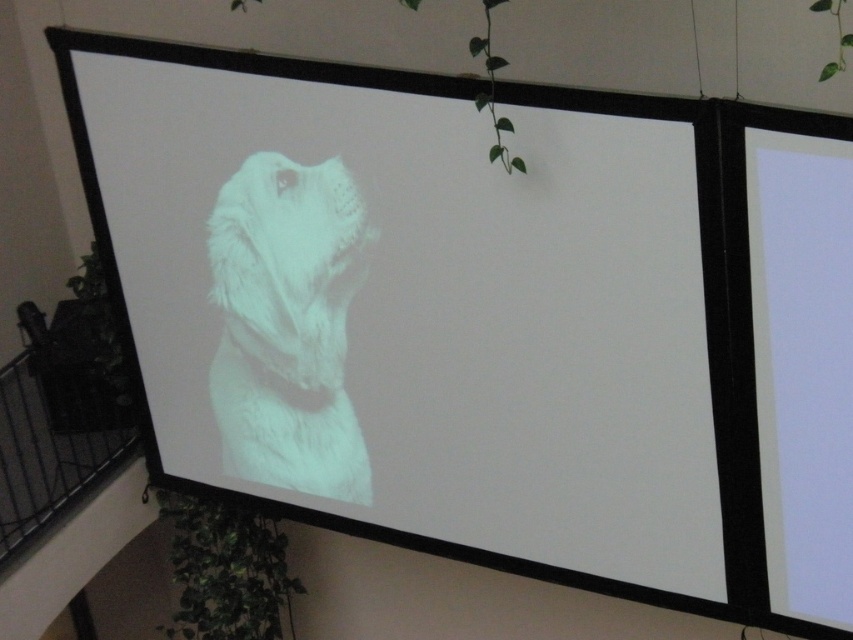
Question: Which of the following is the closest to the observer?

Choices:
 (A) (329, 406)
 (B) (294, 410)

Answer: (A)

Question: Among these objects, which one is farthest from the camera?

Choices:
 (A) white matte dog at center
 (B) white fur dog at center

Answer: (B)

Question: Is white matte dog at center smaller than white fur dog at center?

Choices:
 (A) yes
 (B) no

Answer: (B)

Question: Is white matte dog at center wider than white fur dog at center?

Choices:
 (A) yes
 (B) no

Answer: (A)

Question: Which object is closer to the camera taking this photo?

Choices:
 (A) white fur dog at center
 (B) white matte dog at center

Answer: (B)

Question: Can you confirm if white matte dog at center is positioned to the left of white fur dog at center?

Choices:
 (A) yes
 (B) no

Answer: (B)